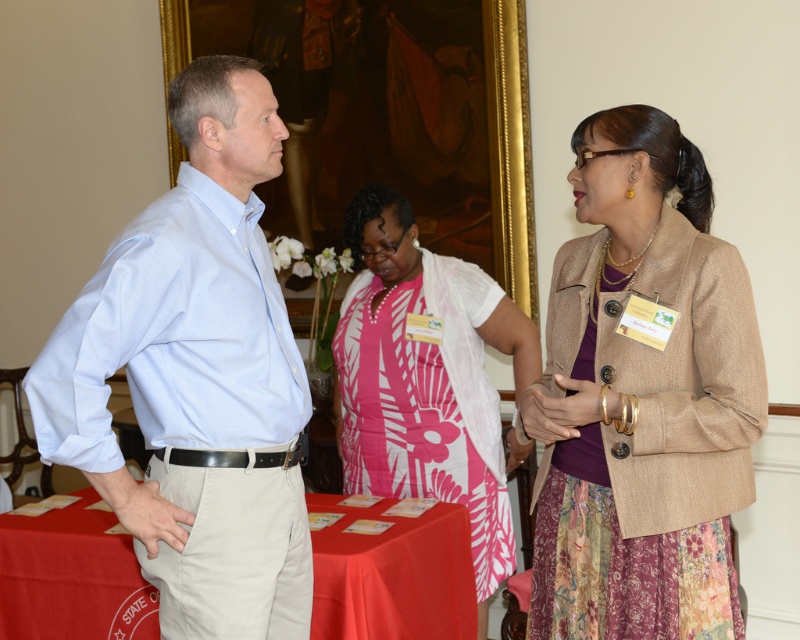
Which is more to the left, light blue shirt at left or pink fabric dress at center?

light blue shirt at left

Is light blue shirt at left to the left of pink fabric dress at center from the viewer's perspective?

Correct, you'll find light blue shirt at left to the left of pink fabric dress at center.

At what (x,y) coordinates should I click in order to perform the action: click on light blue shirt at left. Please return your answer as a coordinate pair (x, y). The height and width of the screenshot is (640, 800). Looking at the image, I should click on (196, 376).

How distant is beige textured blazer at right from red cloth table at lower left?

A distance of 35.04 inches exists between beige textured blazer at right and red cloth table at lower left.

Is beige textured blazer at right to the right of red cloth table at lower left from the viewer's perspective?

Indeed, beige textured blazer at right is positioned on the right side of red cloth table at lower left.

You are a GUI agent. You are given a task and a screenshot of the screen. Output one action in this format:
    pyautogui.click(x=<x>, y=<y>)
    Task: Click on the beige textured blazer at right
    This screenshot has width=800, height=640.
    Given the screenshot: What is the action you would take?
    pyautogui.click(x=642, y=397)

How far apart are light blue shirt at left and red cloth table at lower left?

28.16 inches

Is light blue shirt at left above red cloth table at lower left?

Yes.

Where is `light blue shirt at left`? light blue shirt at left is located at coordinates click(x=196, y=376).